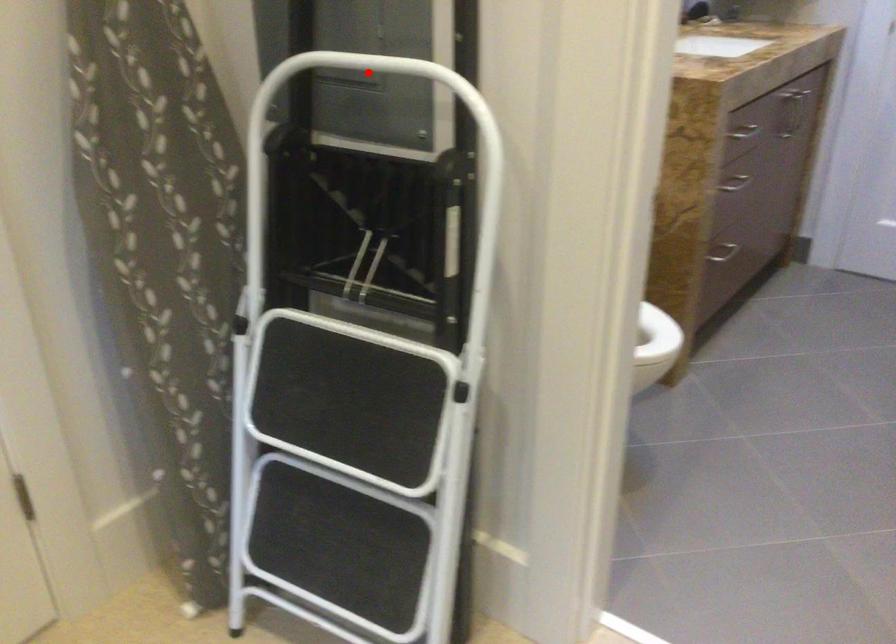
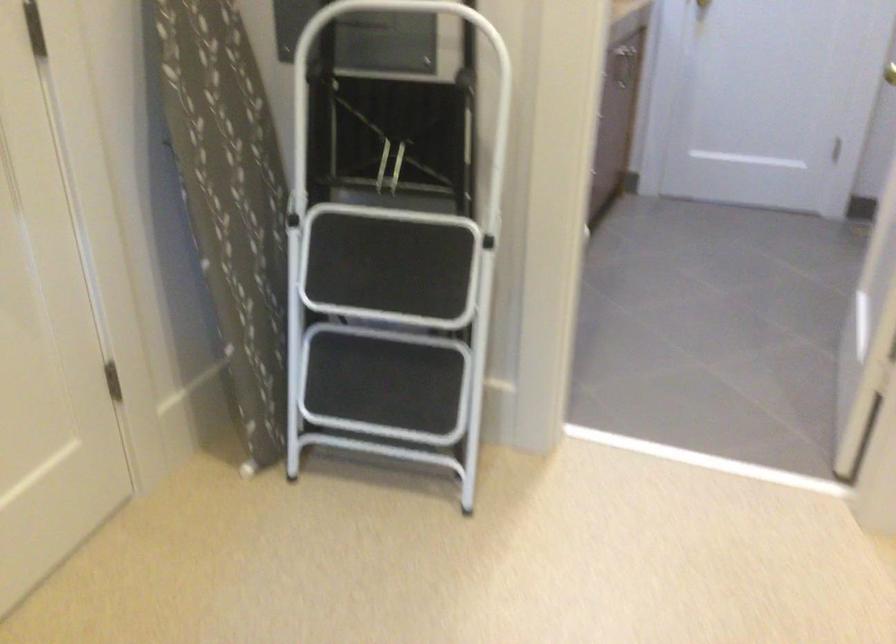
The point at the highlighted location is marked in the first image. Where is the corresponding point in the second image?

(378, 13)